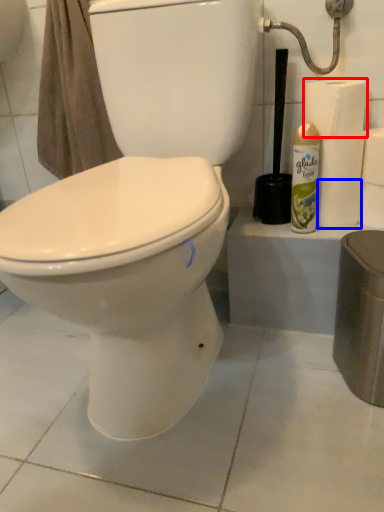
Question: Which object is further to the camera taking this photo, toilet paper (highlighted by a red box) or toilet paper (highlighted by a blue box)?

Choices:
 (A) toilet paper
 (B) toilet paper

Answer: (B)